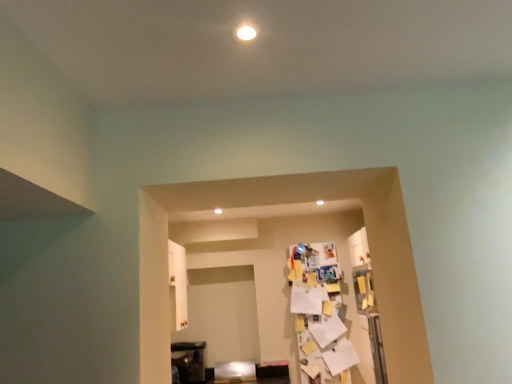
How much space does metallic dark brown cabinet at lower left, marked as the 2th furniture in a right-to-left arrangement, occupy horizontally?

10.91 inches.

Identify the location of metallic dark brown cabinet at lower left, the 1th furniture from the left. pos(189,361).

Describe the element at coordinates (189, 361) in the screenshot. I see `metallic dark brown cabinet at lower left, the 1th furniture from the left` at that location.

This screenshot has height=384, width=512. Identify the location of metallic silver fridge at lower center, placed as the second furniture when sorted from left to right. [x=234, y=372].

Measure the distance between point (228,364) and camera.

They are 13.57 feet apart.

This screenshot has height=384, width=512. What do you see at coordinates (234, 372) in the screenshot?
I see `metallic silver fridge at lower center, the 1th furniture from the right` at bounding box center [234, 372].

The height and width of the screenshot is (384, 512). Find the location of `metallic dark brown cabinet at lower left, the 1th furniture from the left`. metallic dark brown cabinet at lower left, the 1th furniture from the left is located at coordinates (189, 361).

Does metallic dark brown cabinet at lower left, marked as the 2th furniture in a right-to-left arrangement, appear on the right side of metallic silver fridge at lower center, placed as the second furniture when sorted from left to right?

In fact, metallic dark brown cabinet at lower left, marked as the 2th furniture in a right-to-left arrangement, is to the left of metallic silver fridge at lower center, placed as the second furniture when sorted from left to right.

Which object is further away from the camera, metallic dark brown cabinet at lower left, marked as the 2th furniture in a right-to-left arrangement, or metallic silver fridge at lower center, the 1th furniture from the right?

metallic dark brown cabinet at lower left, marked as the 2th furniture in a right-to-left arrangement.

Between point (191, 369) and point (222, 365), which one is positioned in front?

Point (191, 369)

From the image's perspective, is metallic dark brown cabinet at lower left, the 1th furniture from the left, above metallic silver fridge at lower center, placed as the second furniture when sorted from left to right?

Yes.

In the scene shown: From a real-world perspective, is metallic dark brown cabinet at lower left, the 1th furniture from the left, located higher than metallic silver fridge at lower center, placed as the second furniture when sorted from left to right?

Yes, from a real-world perspective, metallic dark brown cabinet at lower left, the 1th furniture from the left, is over metallic silver fridge at lower center, placed as the second furniture when sorted from left to right

Can you confirm if metallic dark brown cabinet at lower left, the 1th furniture from the left, is wider than metallic silver fridge at lower center, the 1th furniture from the right?

Correct, the width of metallic dark brown cabinet at lower left, the 1th furniture from the left, exceeds that of metallic silver fridge at lower center, the 1th furniture from the right.

Which of these two, metallic dark brown cabinet at lower left, marked as the 2th furniture in a right-to-left arrangement, or metallic silver fridge at lower center, the 1th furniture from the right, stands taller?

Standing taller between the two is metallic dark brown cabinet at lower left, marked as the 2th furniture in a right-to-left arrangement.

Based on the photo, who is smaller, metallic dark brown cabinet at lower left, marked as the 2th furniture in a right-to-left arrangement, or metallic silver fridge at lower center, placed as the second furniture when sorted from left to right?

metallic silver fridge at lower center, placed as the second furniture when sorted from left to right.

Is metallic dark brown cabinet at lower left, marked as the 2th furniture in a right-to-left arrangement, not inside metallic silver fridge at lower center, the 1th furniture from the right?

metallic dark brown cabinet at lower left, marked as the 2th furniture in a right-to-left arrangement, is positioned outside metallic silver fridge at lower center, the 1th furniture from the right.

Is metallic dark brown cabinet at lower left, the 1th furniture from the left, far from metallic silver fridge at lower center, the 1th furniture from the right?

No.

Is metallic dark brown cabinet at lower left, the 1th furniture from the left, oriented away from metallic silver fridge at lower center, placed as the second furniture when sorted from left to right?

That's not correct — metallic dark brown cabinet at lower left, the 1th furniture from the left, is not looking away from metallic silver fridge at lower center, placed as the second furniture when sorted from left to right.

The image size is (512, 384). In the image, there is a metallic silver fridge at lower center, the 1th furniture from the right. Identify the location of furniture above it (from the image's perspective). (189, 361).

In the image, is metallic silver fridge at lower center, placed as the second furniture when sorted from left to right, on the left side or the right side of metallic dark brown cabinet at lower left, marked as the 2th furniture in a right-to-left arrangement?

metallic silver fridge at lower center, placed as the second furniture when sorted from left to right, is to the right of metallic dark brown cabinet at lower left, marked as the 2th furniture in a right-to-left arrangement.

Is metallic silver fridge at lower center, the 1th furniture from the right, in front of metallic dark brown cabinet at lower left, marked as the 2th furniture in a right-to-left arrangement?

Yes, metallic silver fridge at lower center, the 1th furniture from the right, is in front of metallic dark brown cabinet at lower left, marked as the 2th furniture in a right-to-left arrangement.

Is point (242, 369) closer or farther from the camera than point (196, 353)?

Clearly, point (242, 369) is closer to the camera than point (196, 353).

From the image's perspective, is metallic silver fridge at lower center, the 1th furniture from the right, on top of metallic dark brown cabinet at lower left, marked as the 2th furniture in a right-to-left arrangement?

No, from the image's perspective, metallic silver fridge at lower center, the 1th furniture from the right, is not on top of metallic dark brown cabinet at lower left, marked as the 2th furniture in a right-to-left arrangement.

Looking at this image, from a real-world perspective, is metallic silver fridge at lower center, placed as the second furniture when sorted from left to right, below metallic dark brown cabinet at lower left, marked as the 2th furniture in a right-to-left arrangement?

Indeed, from a real-world perspective, metallic silver fridge at lower center, placed as the second furniture when sorted from left to right, is positioned beneath metallic dark brown cabinet at lower left, marked as the 2th furniture in a right-to-left arrangement.

Between metallic silver fridge at lower center, placed as the second furniture when sorted from left to right, and metallic dark brown cabinet at lower left, the 1th furniture from the left, which one has smaller width?

Thinner between the two is metallic silver fridge at lower center, placed as the second furniture when sorted from left to right.

In terms of height, does metallic silver fridge at lower center, placed as the second furniture when sorted from left to right, look taller or shorter compared to metallic dark brown cabinet at lower left, marked as the 2th furniture in a right-to-left arrangement?

Clearly, metallic silver fridge at lower center, placed as the second furniture when sorted from left to right, is shorter compared to metallic dark brown cabinet at lower left, marked as the 2th furniture in a right-to-left arrangement.

Looking at this image, is metallic silver fridge at lower center, placed as the second furniture when sorted from left to right, smaller than metallic dark brown cabinet at lower left, marked as the 2th furniture in a right-to-left arrangement?

Correct, metallic silver fridge at lower center, placed as the second furniture when sorted from left to right, occupies less space than metallic dark brown cabinet at lower left, marked as the 2th furniture in a right-to-left arrangement.

Could metallic dark brown cabinet at lower left, marked as the 2th furniture in a right-to-left arrangement, be considered to be inside metallic silver fridge at lower center, placed as the second furniture when sorted from left to right?

No, metallic dark brown cabinet at lower left, marked as the 2th furniture in a right-to-left arrangement, is not a part of metallic silver fridge at lower center, placed as the second furniture when sorted from left to right.

Is there a large distance between metallic silver fridge at lower center, placed as the second furniture when sorted from left to right, and metallic dark brown cabinet at lower left, the 1th furniture from the left?

metallic silver fridge at lower center, placed as the second furniture when sorted from left to right, is actually quite close to metallic dark brown cabinet at lower left, the 1th furniture from the left.

Could you tell me if metallic silver fridge at lower center, placed as the second furniture when sorted from left to right, is turned towards metallic dark brown cabinet at lower left, the 1th furniture from the left?

No, metallic silver fridge at lower center, placed as the second furniture when sorted from left to right, is not oriented towards metallic dark brown cabinet at lower left, the 1th furniture from the left.

How many degrees apart are the facing directions of metallic silver fridge at lower center, placed as the second furniture when sorted from left to right, and metallic dark brown cabinet at lower left, marked as the 2th furniture in a right-to-left arrangement?

0.917 degrees.

Find the location of a particular element. furniture below the metallic dark brown cabinet at lower left, marked as the 2th furniture in a right-to-left arrangement (from a real-world perspective) is located at coordinates 234,372.

You are a GUI agent. You are given a task and a screenshot of the screen. Output one action in this format:
    pyautogui.click(x=<x>, y=<y>)
    Task: Click on the furniture on the left of metallic silver fridge at lower center, placed as the second furniture when sorted from left to right
    The width and height of the screenshot is (512, 384).
    Given the screenshot: What is the action you would take?
    pyautogui.click(x=189, y=361)

This screenshot has height=384, width=512. In order to click on furniture behind the metallic silver fridge at lower center, placed as the second furniture when sorted from left to right in this screenshot , I will do `click(189, 361)`.